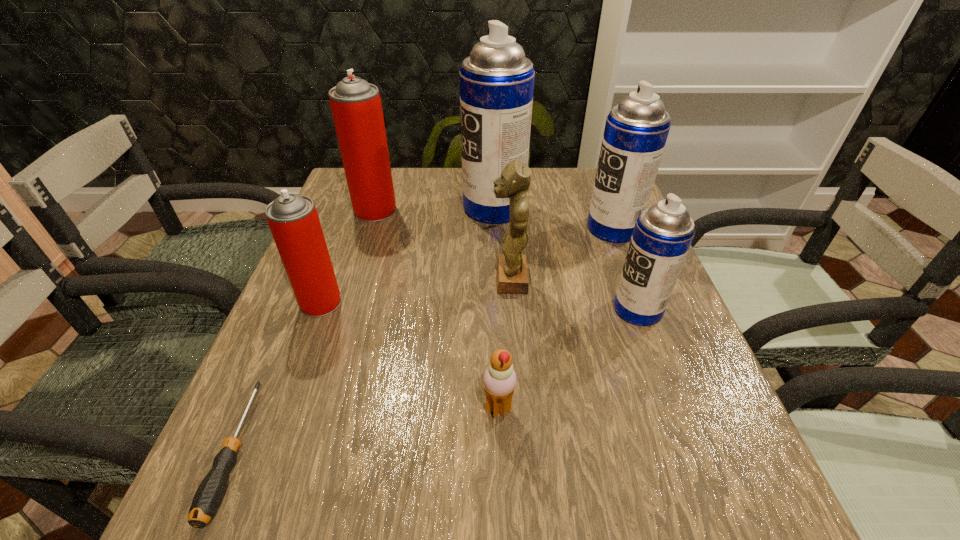
Where is `vacant space located on the label side of the nearest blue aerosol can`? The image size is (960, 540). vacant space located on the label side of the nearest blue aerosol can is located at coordinates (502, 309).

Locate an element on the screen. vacant space positioned on the label side of the nearest blue aerosol can is located at coordinates (497, 309).

Where is `vacant position located 0.310m on the right of the smaller red aerosol can`? The width and height of the screenshot is (960, 540). vacant position located 0.310m on the right of the smaller red aerosol can is located at coordinates (489, 302).

The width and height of the screenshot is (960, 540). I want to click on vacant position located 0.370m at the front with a straw on the icecream, so click(262, 409).

Where is `vacant region located at the front with a straw on the icecream`? This screenshot has width=960, height=540. vacant region located at the front with a straw on the icecream is located at coordinates (268, 409).

Locate an element on the screen. This screenshot has height=540, width=960. free space located at the front with a straw on the icecream is located at coordinates (316, 409).

You are a GUI agent. You are given a task and a screenshot of the screen. Output one action in this format:
    pyautogui.click(x=<x>, y=<y>)
    Task: Click on the vacant space located 0.300m on the right of the shortest object
    
    Given the screenshot: What is the action you would take?
    pyautogui.click(x=441, y=451)

You are a GUI agent. You are given a task and a screenshot of the screen. Output one action in this format:
    pyautogui.click(x=<x>, y=<y>)
    Task: Click on the object present at the near edge
    This screenshot has width=960, height=540.
    Given the screenshot: What is the action you would take?
    pyautogui.click(x=209, y=494)

The width and height of the screenshot is (960, 540). In order to click on screwdriver at the left edge in this screenshot , I will do `click(209, 494)`.

Identify the location of object that is positioned at the far left corner. This screenshot has width=960, height=540. (356, 107).